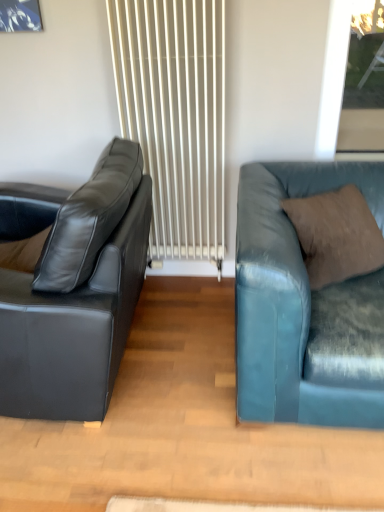
Question: Is teal leather couch at right, the 1th studio couch from the right, smaller than brown suede pillow at right?

Choices:
 (A) no
 (B) yes

Answer: (A)

Question: Is teal leather couch at right, the 2th studio couch positioned from the left, not close to brown suede pillow at right?

Choices:
 (A) yes
 (B) no

Answer: (B)

Question: Is teal leather couch at right, the 2th studio couch positioned from the left, to the right of brown suede pillow at right from the viewer's perspective?

Choices:
 (A) no
 (B) yes

Answer: (B)

Question: Is teal leather couch at right, the 1th studio couch from the right, bigger than brown suede pillow at right?

Choices:
 (A) no
 (B) yes

Answer: (B)

Question: From a real-world perspective, does teal leather couch at right, the 2th studio couch positioned from the left, stand above brown suede pillow at right?

Choices:
 (A) yes
 (B) no

Answer: (B)

Question: In terms of size, does brown suede pillow at right appear bigger or smaller than matte black leather couch at left, the second studio couch positioned from the right?

Choices:
 (A) big
 (B) small

Answer: (B)

Question: In terms of width, does brown suede pillow at right look wider or thinner when compared to matte black leather couch at left, which is the first studio couch in left-to-right order?

Choices:
 (A) thin
 (B) wide

Answer: (A)

Question: From a real-world perspective, is brown suede pillow at right positioned above or below matte black leather couch at left, the second studio couch positioned from the right?

Choices:
 (A) below
 (B) above

Answer: (B)

Question: Considering the positions of point (314, 287) and point (8, 339), is point (314, 287) closer or farther from the camera than point (8, 339)?

Choices:
 (A) farther
 (B) closer

Answer: (A)

Question: In the image, is teal leather couch at right, the 2th studio couch positioned from the left, positioned in front of or behind brown suede pillow at right?

Choices:
 (A) behind
 (B) front

Answer: (B)

Question: From a real-world perspective, is teal leather couch at right, the 2th studio couch positioned from the left, physically located above or below brown suede pillow at right?

Choices:
 (A) below
 (B) above

Answer: (A)

Question: Considering the relative positions of teal leather couch at right, the 2th studio couch positioned from the left, and brown suede pillow at right in the image provided, is teal leather couch at right, the 2th studio couch positioned from the left, to the left or to the right of brown suede pillow at right?

Choices:
 (A) left
 (B) right

Answer: (B)

Question: Is teal leather couch at right, the 1th studio couch from the right, bigger or smaller than brown suede pillow at right?

Choices:
 (A) small
 (B) big

Answer: (B)

Question: Relative to transparent glass window at upper right, is brown suede pillow at right in front or behind?

Choices:
 (A) behind
 (B) front

Answer: (B)

Question: Considering the positions of brown suede pillow at right and transparent glass window at upper right in the image, is brown suede pillow at right taller or shorter than transparent glass window at upper right?

Choices:
 (A) tall
 (B) short

Answer: (B)